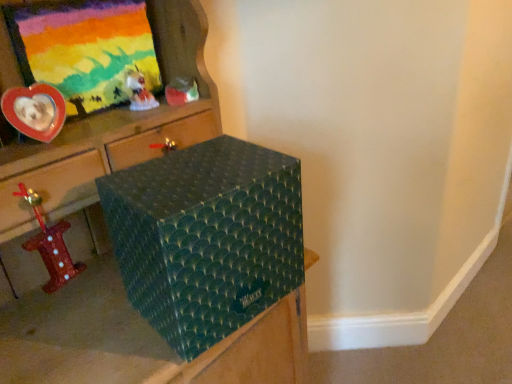
Identify the location of empty space that is ontop of teal textured box at center. The width and height of the screenshot is (512, 384). (202, 166).